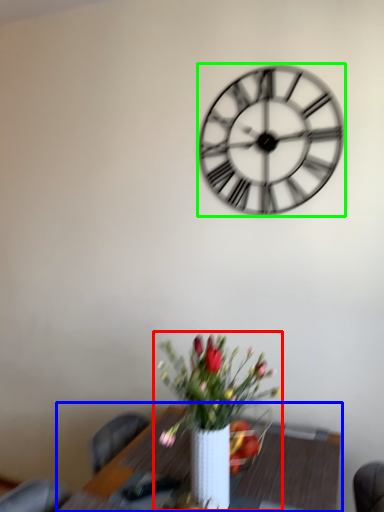
Question: Based on their relative distances, which object is farther from houseplant (highlighted by a red box)? Choose from table (highlighted by a blue box) and wall clock (highlighted by a green box).

Choices:
 (A) table
 (B) wall clock

Answer: (B)